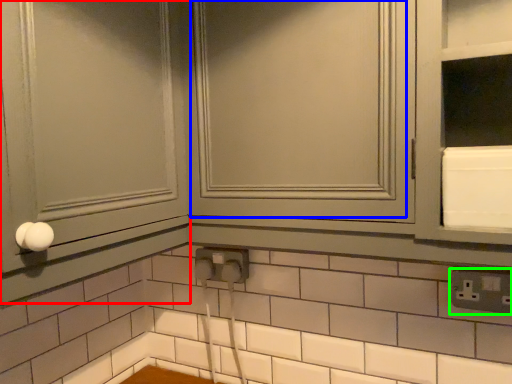
Question: Estimate the real-world distances between objects in this image. Which object is farther from screen door (highlighted by a red box), window (highlighted by a blue box) or electric outlet (highlighted by a green box)?

Choices:
 (A) window
 (B) electric outlet

Answer: (B)